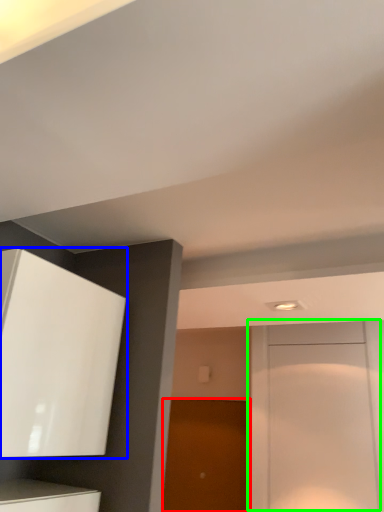
Question: Considering the real-world distances, which object is closest to door (highlighted by a red box)? cabinetry (highlighted by a blue box) or door (highlighted by a green box).

Choices:
 (A) cabinetry
 (B) door

Answer: (B)